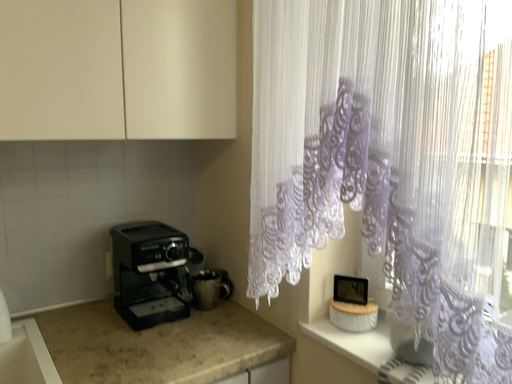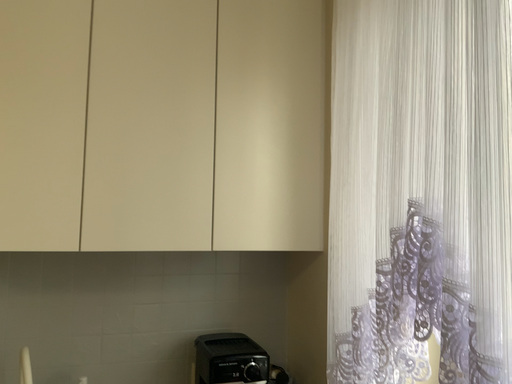
Question: How did the camera likely rotate when shooting the video?

Choices:
 (A) rotated downward
 (B) rotated upward

Answer: (B)